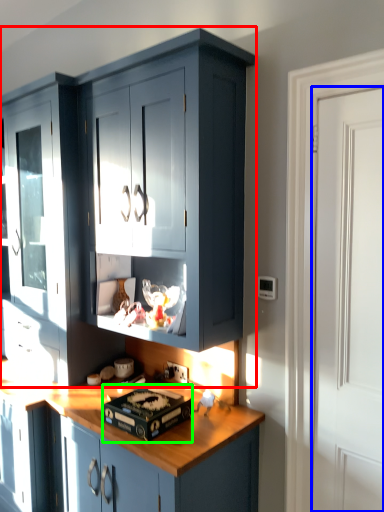
Question: Based on their relative distances, which object is nearer to cabinetry (highlighted by a red box)? Choose from door (highlighted by a blue box) and appliance (highlighted by a green box).

Choices:
 (A) door
 (B) appliance

Answer: (B)